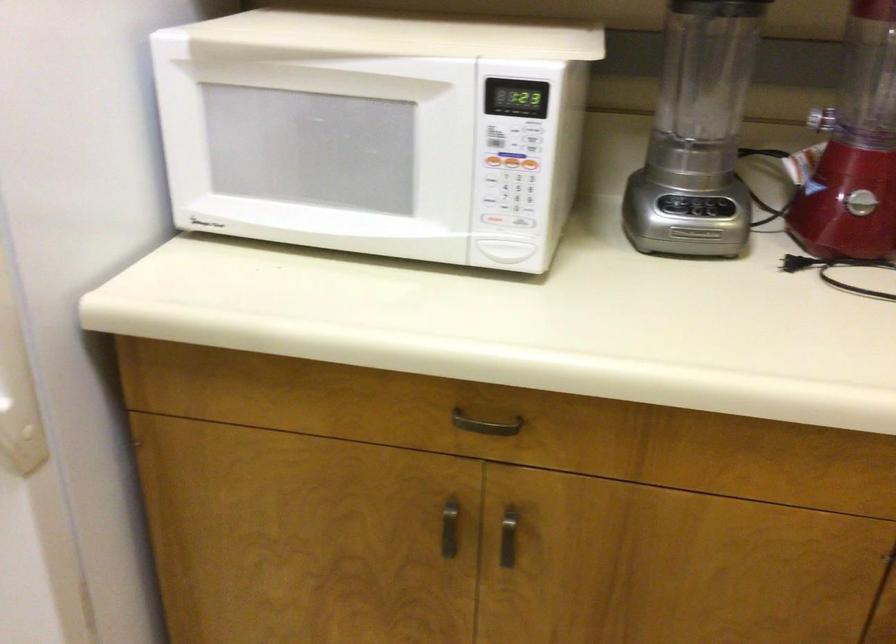
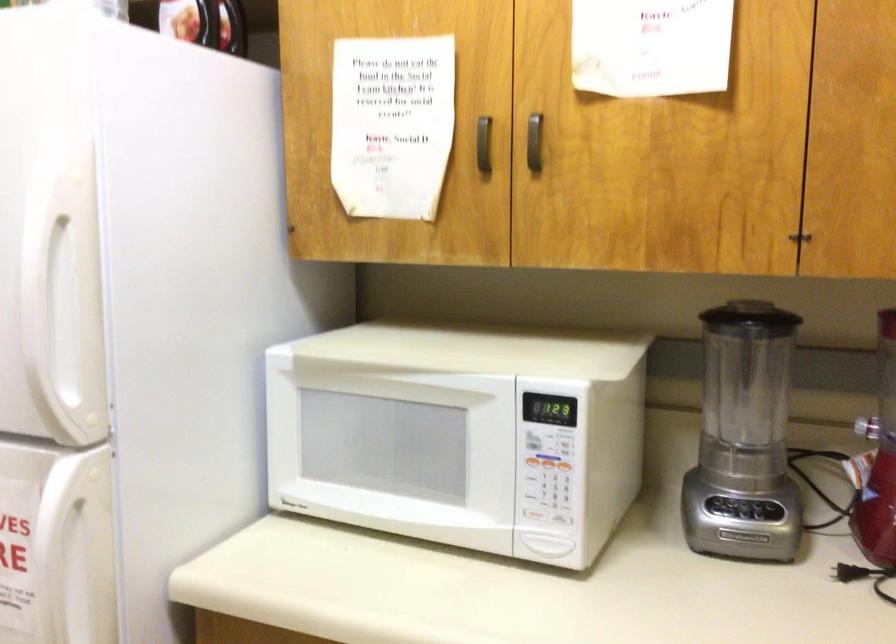
Question: How did the camera likely rotate?

Choices:
 (A) Left
 (B) Right
 (C) Up
 (D) Down

Answer: (C)